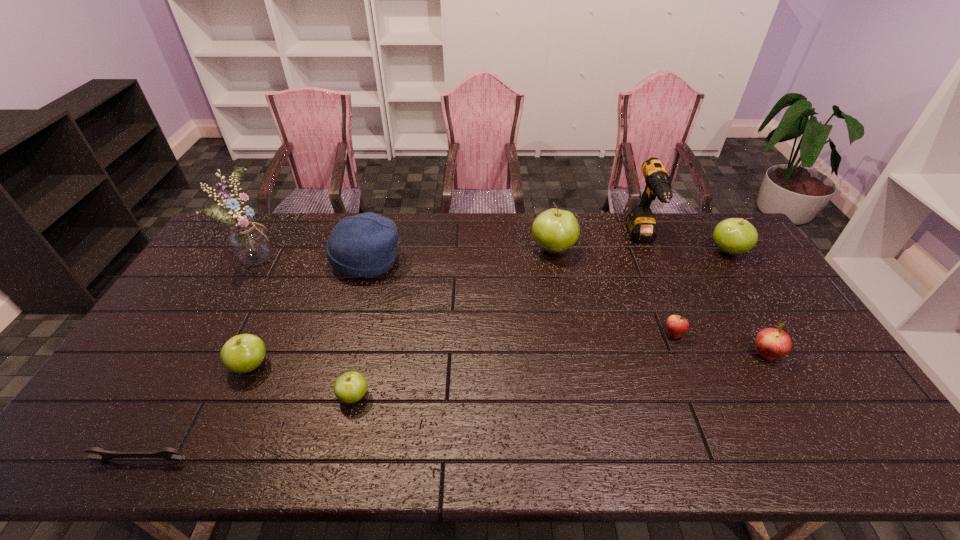
This screenshot has height=540, width=960. I want to click on skullcap that is positioned at the far edge, so click(x=364, y=246).

The image size is (960, 540). Find the location of `object located at the near edge`. object located at the near edge is located at coordinates (166, 453).

I want to click on bouquet located in the left edge section of the desktop, so click(x=249, y=242).

The image size is (960, 540). Find the location of `wrench at the left edge`. wrench at the left edge is located at coordinates (166, 453).

In order to click on object positioned at the far left corner in this screenshot , I will do `click(249, 242)`.

This screenshot has height=540, width=960. Identify the location of object at the near left corner. (166, 453).

This screenshot has height=540, width=960. Find the location of `object positioned at the far right corner`. object positioned at the far right corner is located at coordinates (733, 236).

Find the location of a particular element. The height and width of the screenshot is (540, 960). blank space at the far edge of the desktop is located at coordinates (668, 218).

Locate an element on the screen. This screenshot has height=540, width=960. free space at the near edge is located at coordinates (679, 456).

The height and width of the screenshot is (540, 960). Identify the location of vacant position at the right edge of the desktop. (844, 415).